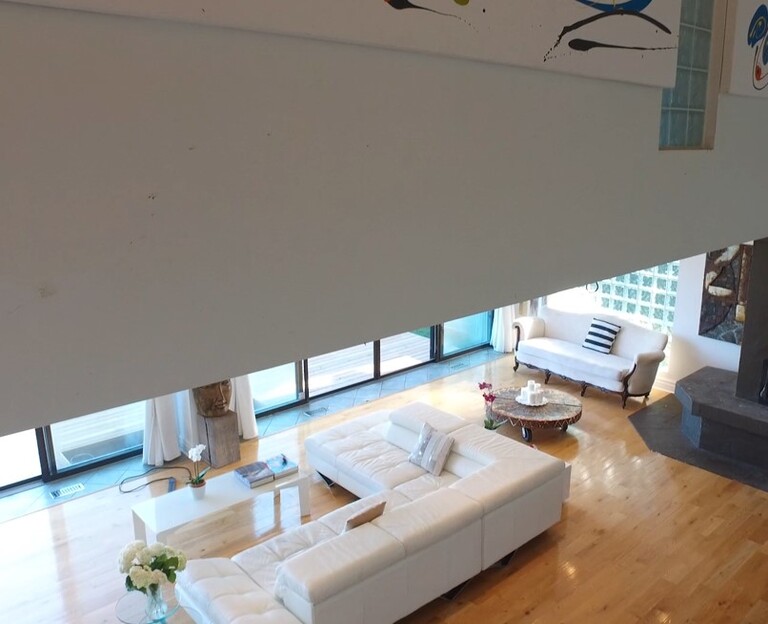
Image resolution: width=768 pixels, height=624 pixels. Find the location of `tile window`. tile window is located at coordinates (697, 85).